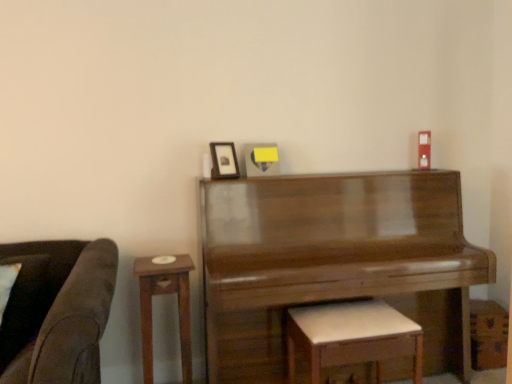
This screenshot has width=512, height=384. In order to click on free space above white leather stool at lower center (from a real-world perspective) in this screenshot , I will do `click(359, 306)`.